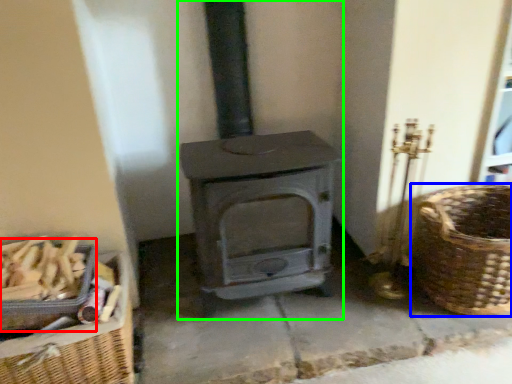
Question: Which object is the closest to the basket (highlighted by a red box)? Choose among these: basket (highlighted by a blue box) or wood burning stove (highlighted by a green box).

Choices:
 (A) basket
 (B) wood burning stove

Answer: (B)